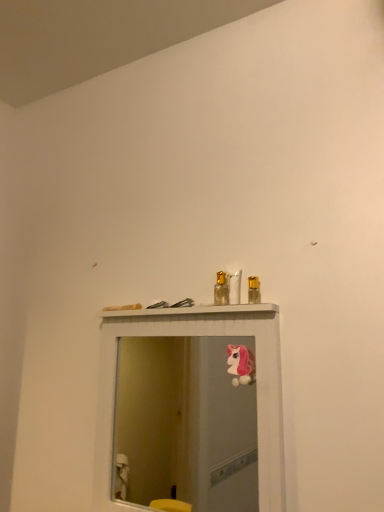
In order to click on white glossy mirror at upper center in this screenshot , I will do `click(184, 425)`.

Where is `metallic gold spray can at upper center, which is the 1th toiletry in right-to-left order`? metallic gold spray can at upper center, which is the 1th toiletry in right-to-left order is located at coordinates (254, 290).

From the image's perspective, which one is positioned lower, pink plush unicorn at upper center or white glossy mirror at upper center?

white glossy mirror at upper center appears lower in the image.

Measure the distance from pink plush unicorn at upper center to white glossy mirror at upper center.

pink plush unicorn at upper center and white glossy mirror at upper center are 5.78 feet apart from each other.

Is pink plush unicorn at upper center looking in the opposite direction of white glossy mirror at upper center?

Correct, pink plush unicorn at upper center is looking away from white glossy mirror at upper center.

Who is smaller, pink plush unicorn at upper center or metallic gold spray can at upper center, positioned as the 2th toiletry in left-to-right order?

metallic gold spray can at upper center, positioned as the 2th toiletry in left-to-right order, is smaller.

Considering the positions of objects pink plush unicorn at upper center and metallic gold spray can at upper center, which is the 1th toiletry in right-to-left order, in the image provided, who is in front, pink plush unicorn at upper center or metallic gold spray can at upper center, which is the 1th toiletry in right-to-left order,?

pink plush unicorn at upper center is in front.

Is pink plush unicorn at upper center located outside metallic gold spray can at upper center, which is the 1th toiletry in right-to-left order?

Yes, pink plush unicorn at upper center is located beyond the bounds of metallic gold spray can at upper center, which is the 1th toiletry in right-to-left order.

From a real-world perspective, is pink plush unicorn at upper center positioned under metallic gold spray can at upper center, positioned as the 2th toiletry in left-to-right order, based on gravity?

Indeed, from a real-world perspective, pink plush unicorn at upper center is positioned beneath metallic gold spray can at upper center, positioned as the 2th toiletry in left-to-right order.

What's the angular difference between white glossy mirror at upper center and gold metallic perfume bottle at center, the 2th toiletry in the right-to-left sequence,'s facing directions?

0.0059 degrees separate the facing orientations of white glossy mirror at upper center and gold metallic perfume bottle at center, the 2th toiletry in the right-to-left sequence.

At what (x,y) coordinates should I click in order to perform the action: click on mirror on the left side of gold metallic perfume bottle at center, the 2th toiletry in the right-to-left sequence. Please return your answer as a coordinate pair (x, y). The width and height of the screenshot is (384, 512). Looking at the image, I should click on (184, 425).

Is white glossy mirror at upper center spatially inside gold metallic perfume bottle at center, the 2th toiletry in the right-to-left sequence, or outside of it?

white glossy mirror at upper center is not enclosed by gold metallic perfume bottle at center, the 2th toiletry in the right-to-left sequence.

In the scene shown: From a real-world perspective, is white glossy mirror at upper center positioned under gold metallic perfume bottle at center, the 2th toiletry in the right-to-left sequence, based on gravity?

Yes, from a real-world perspective, white glossy mirror at upper center is below gold metallic perfume bottle at center, the 2th toiletry in the right-to-left sequence.

From the picture: From the image's perspective, is gold metallic perfume bottle at center, arranged as the first toiletry when viewed from the left, above metallic gold spray can at upper center, positioned as the 2th toiletry in left-to-right order?

Yes, from the image's perspective, gold metallic perfume bottle at center, arranged as the first toiletry when viewed from the left, is over metallic gold spray can at upper center, positioned as the 2th toiletry in left-to-right order.

Is point (216, 302) farther from camera compared to point (248, 278)?

That is True.

Is gold metallic perfume bottle at center, arranged as the first toiletry when viewed from the left, inside the boundaries of metallic gold spray can at upper center, positioned as the 2th toiletry in left-to-right order, or outside?

gold metallic perfume bottle at center, arranged as the first toiletry when viewed from the left, is not inside metallic gold spray can at upper center, positioned as the 2th toiletry in left-to-right order, it's outside.

What's the angular difference between white glossy mirror at upper center and metallic gold spray can at upper center, which is the 1th toiletry in right-to-left order,'s facing directions?

There is a 0.00112-degree angle between the facing directions of white glossy mirror at upper center and metallic gold spray can at upper center, which is the 1th toiletry in right-to-left order.

From the image's perspective, does white glossy mirror at upper center appear higher than metallic gold spray can at upper center, positioned as the 2th toiletry in left-to-right order?

No, from the image's perspective, white glossy mirror at upper center is not on top of metallic gold spray can at upper center, positioned as the 2th toiletry in left-to-right order.

From a real-world perspective, relative to metallic gold spray can at upper center, which is the 1th toiletry in right-to-left order, is white glossy mirror at upper center vertically above or below?

From a real-world perspective, white glossy mirror at upper center is physically below metallic gold spray can at upper center, which is the 1th toiletry in right-to-left order.

Which object is positioned more to the right, white glossy mirror at upper center or metallic gold spray can at upper center, which is the 1th toiletry in right-to-left order?

Positioned to the right is metallic gold spray can at upper center, which is the 1th toiletry in right-to-left order.

Is pink plush unicorn at upper center at the back of metallic gold spray can at upper center, which is the 1th toiletry in right-to-left order?

metallic gold spray can at upper center, which is the 1th toiletry in right-to-left order, is not turned away from pink plush unicorn at upper center.

Which of these two, metallic gold spray can at upper center, positioned as the 2th toiletry in left-to-right order, or pink plush unicorn at upper center, stands taller?

pink plush unicorn at upper center.

Is metallic gold spray can at upper center, which is the 1th toiletry in right-to-left order, outside of pink plush unicorn at upper center?

That's correct, metallic gold spray can at upper center, which is the 1th toiletry in right-to-left order, is outside of pink plush unicorn at upper center.

How distant is metallic gold spray can at upper center, positioned as the 2th toiletry in left-to-right order, from pink plush unicorn at upper center?

metallic gold spray can at upper center, positioned as the 2th toiletry in left-to-right order, is 1.57 meters from pink plush unicorn at upper center.

Based on the photo, does pink plush unicorn at upper center appear on the right side of gold metallic perfume bottle at center, the 2th toiletry in the right-to-left sequence?

Indeed, pink plush unicorn at upper center is positioned on the right side of gold metallic perfume bottle at center, the 2th toiletry in the right-to-left sequence.

Does pink plush unicorn at upper center turn towards gold metallic perfume bottle at center, the 2th toiletry in the right-to-left sequence?

No, pink plush unicorn at upper center does not turn towards gold metallic perfume bottle at center, the 2th toiletry in the right-to-left sequence.

Would you say pink plush unicorn at upper center is a long distance from gold metallic perfume bottle at center, the 2th toiletry in the right-to-left sequence?

pink plush unicorn at upper center is positioned a significant distance from gold metallic perfume bottle at center, the 2th toiletry in the right-to-left sequence.

How different are the orientations of pink plush unicorn at upper center and gold metallic perfume bottle at center, the 2th toiletry in the right-to-left sequence, in degrees?

The angle between the facing direction of pink plush unicorn at upper center and the facing direction of gold metallic perfume bottle at center, the 2th toiletry in the right-to-left sequence, is 2.45 degrees.

Locate an element on the screen. animal that is above the white glossy mirror at upper center (from a real-world perspective) is located at coordinates point(241,365).

Where is `the 1st toiletry positioned above the pink plush unicorn at upper center (from the image's perspective)`? The height and width of the screenshot is (512, 384). the 1st toiletry positioned above the pink plush unicorn at upper center (from the image's perspective) is located at coordinates (254, 290).

Considering their positions, is metallic gold spray can at upper center, which is the 1th toiletry in right-to-left order, positioned further to gold metallic perfume bottle at center, arranged as the first toiletry when viewed from the left, than white glossy mirror at upper center?

white glossy mirror at upper center lies further to gold metallic perfume bottle at center, arranged as the first toiletry when viewed from the left, than the other object.

Consider the image. Estimate the real-world distances between objects in this image. Which object is closer to gold metallic perfume bottle at center, the 2th toiletry in the right-to-left sequence, pink plush unicorn at upper center or metallic gold spray can at upper center, which is the 1th toiletry in right-to-left order?

The object closer to gold metallic perfume bottle at center, the 2th toiletry in the right-to-left sequence, is metallic gold spray can at upper center, which is the 1th toiletry in right-to-left order.

Considering their positions, is white glossy mirror at upper center positioned further to metallic gold spray can at upper center, positioned as the 2th toiletry in left-to-right order, than pink plush unicorn at upper center?

The object further to metallic gold spray can at upper center, positioned as the 2th toiletry in left-to-right order, is white glossy mirror at upper center.

Consider the image. Estimate the real-world distances between objects in this image. Which object is closer to metallic gold spray can at upper center, positioned as the 2th toiletry in left-to-right order, gold metallic perfume bottle at center, arranged as the first toiletry when viewed from the left, or pink plush unicorn at upper center?

gold metallic perfume bottle at center, arranged as the first toiletry when viewed from the left, is closer to metallic gold spray can at upper center, positioned as the 2th toiletry in left-to-right order.

When comparing their distances from pink plush unicorn at upper center, does gold metallic perfume bottle at center, arranged as the first toiletry when viewed from the left, or white glossy mirror at upper center seem closer?

gold metallic perfume bottle at center, arranged as the first toiletry when viewed from the left.

Based on their spatial positions, is metallic gold spray can at upper center, positioned as the 2th toiletry in left-to-right order, or white glossy mirror at upper center further from pink plush unicorn at upper center?

white glossy mirror at upper center is further to pink plush unicorn at upper center.

Looking at the image, which one is located closer to metallic gold spray can at upper center, positioned as the 2th toiletry in left-to-right order, gold metallic perfume bottle at center, arranged as the first toiletry when viewed from the left, or white glossy mirror at upper center?

Among the two, gold metallic perfume bottle at center, arranged as the first toiletry when viewed from the left, is located nearer to metallic gold spray can at upper center, positioned as the 2th toiletry in left-to-right order.

Which object lies further to the anchor point white glossy mirror at upper center, pink plush unicorn at upper center or gold metallic perfume bottle at center, arranged as the first toiletry when viewed from the left?

gold metallic perfume bottle at center, arranged as the first toiletry when viewed from the left, lies further to white glossy mirror at upper center than the other object.

Where is `toiletry between gold metallic perfume bottle at center, arranged as the first toiletry when viewed from the left, and white glossy mirror at upper center from top to bottom`? toiletry between gold metallic perfume bottle at center, arranged as the first toiletry when viewed from the left, and white glossy mirror at upper center from top to bottom is located at coordinates (254, 290).

Locate an element on the screen. animal between metallic gold spray can at upper center, which is the 1th toiletry in right-to-left order, and white glossy mirror at upper center, in the vertical direction is located at coordinates (241, 365).

The height and width of the screenshot is (512, 384). Find the location of `toiletry that lies between gold metallic perfume bottle at center, arranged as the first toiletry when viewed from the left, and pink plush unicorn at upper center from top to bottom`. toiletry that lies between gold metallic perfume bottle at center, arranged as the first toiletry when viewed from the left, and pink plush unicorn at upper center from top to bottom is located at coordinates (254, 290).

You are a GUI agent. You are given a task and a screenshot of the screen. Output one action in this format:
    pyautogui.click(x=<x>, y=<y>)
    Task: Click on the animal between gold metallic perfume bottle at center, the 2th toiletry in the right-to-left sequence, and white glossy mirror at upper center from top to bottom
    
    Given the screenshot: What is the action you would take?
    pyautogui.click(x=241, y=365)